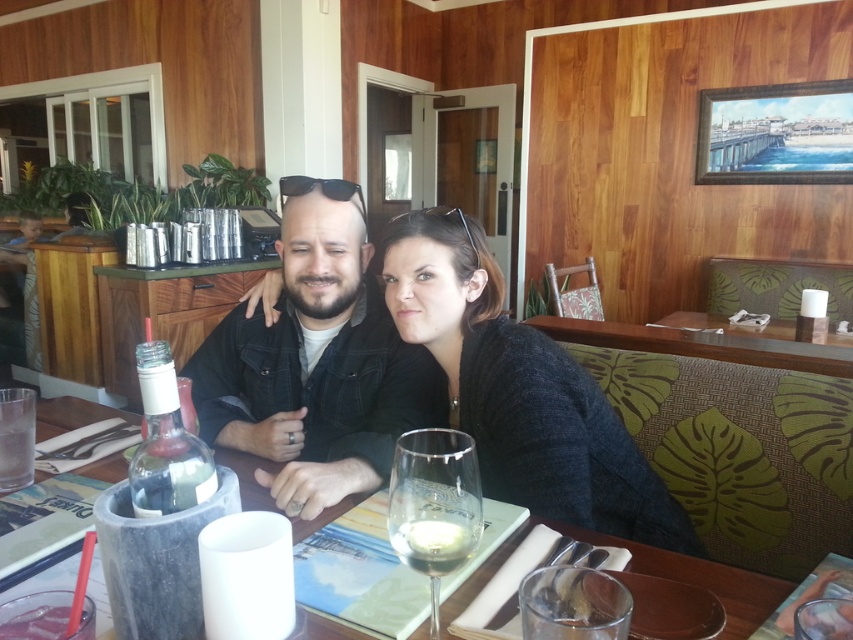
From the picture: You are a waiter in a restaurant. You see the clear glass wine glass at center and the clear glass wine at center on the table. Which one is more to the left?

The clear glass wine glass at center is positioned on the left side of clear glass wine at center.

You are a server in this restaurant and need to place a new menu between the dark gray sweater at center and the translucent glass bottle at center. Which object should you place the menu closer to to ensure it stands upright?

The menu should be placed closer to the dark gray sweater at center because it is much taller than the translucent glass bottle at center, providing better support for the menu to stand upright.

Based on the photo, you are a waiter in a restaurant and need to place a new menu between the dark gray sweater at center and the clear glass wine at center. Based on their positions, which object should you place the menu closer to?

The dark gray sweater at center is to the right of the clear glass wine at center. Therefore, the menu should be placed closer to the clear glass wine at center to maintain proper spacing between the two items.